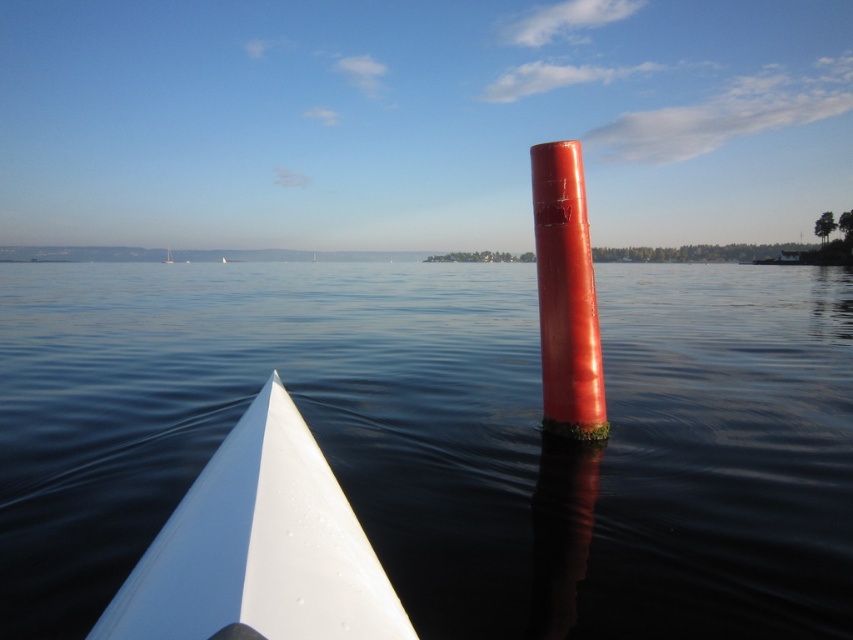
Question: Where is smooth water at center located in relation to glossy red pole at center in the image?

Choices:
 (A) left
 (B) right

Answer: (B)

Question: Estimate the real-world distances between objects in this image. Which object is farther from the smooth water at center?

Choices:
 (A) white glossy boat at lower left
 (B) glossy red pole at center

Answer: (B)

Question: Does smooth water at center come in front of white glossy boat at lower left?

Choices:
 (A) yes
 (B) no

Answer: (B)

Question: Which point appears farthest from the camera in this image?

Choices:
 (A) (643, 310)
 (B) (318, 564)
 (C) (582, 256)

Answer: (A)

Question: Among these points, which one is nearest to the camera?

Choices:
 (A) (552, 154)
 (B) (154, 525)
 (C) (270, 452)

Answer: (C)

Question: Does white glossy boat at lower left have a lesser width compared to glossy red pole at center?

Choices:
 (A) no
 (B) yes

Answer: (A)